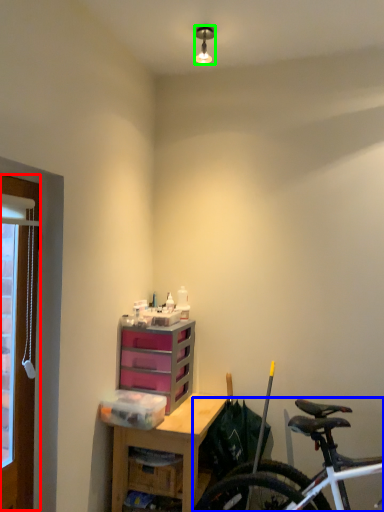
Question: Considering the real-world distances, which object is closest to window frame (highlighted by a red box)? bicycle (highlighted by a blue box) or lamp (highlighted by a green box).

Choices:
 (A) bicycle
 (B) lamp

Answer: (A)